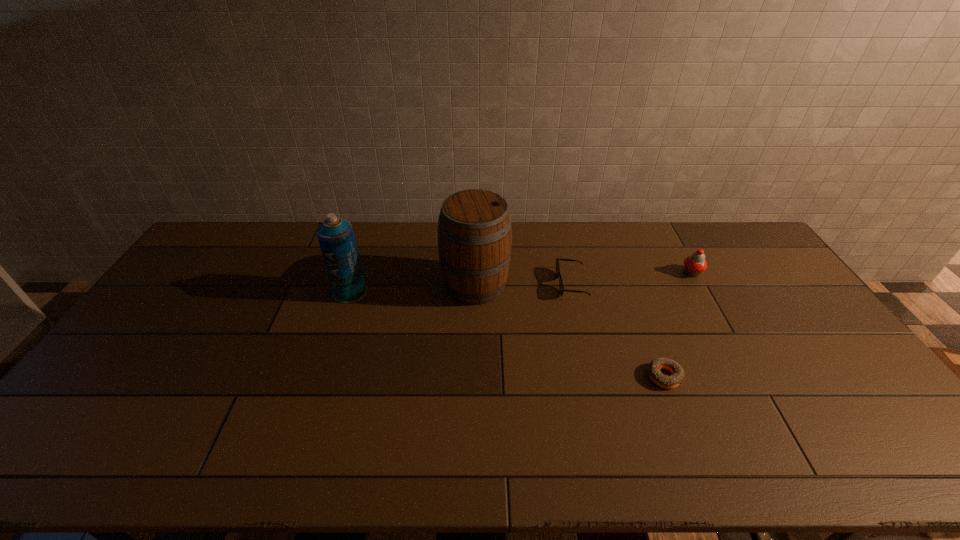
Image resolution: width=960 pixels, height=540 pixels. I want to click on cider, so click(x=474, y=227).

Find the location of a particular element. The height and width of the screenshot is (540, 960). aerosol can is located at coordinates (336, 237).

The height and width of the screenshot is (540, 960). What are the coordinates of `the third tallest object` in the screenshot? It's located at (695, 264).

At what (x,y) coordinates should I click in order to perform the action: click on cupcake. Please return your answer as a coordinate pair (x, y). The width and height of the screenshot is (960, 540). Looking at the image, I should click on (695, 264).

Identify the location of sunglasses. (561, 287).

Locate an element on the screen. The image size is (960, 540). the third object from left to right is located at coordinates (561, 287).

Where is `the shortest object`? the shortest object is located at coordinates (654, 372).

Locate an element on the screen. The height and width of the screenshot is (540, 960). the fourth object from left to right is located at coordinates (654, 372).

Identify the location of free region located 0.400m on the left of the fourth object from right to left. This screenshot has width=960, height=540. (321, 285).

Where is `vacant area located 0.300m on the back of the leftmost object`? Image resolution: width=960 pixels, height=540 pixels. vacant area located 0.300m on the back of the leftmost object is located at coordinates (371, 230).